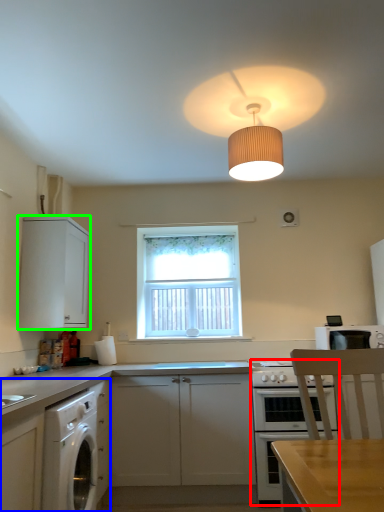
Question: Which object is positioned closest to oven (highlighted by a red box)? Select from cabinetry (highlighted by a blue box) and cabinetry (highlighted by a green box).

Choices:
 (A) cabinetry
 (B) cabinetry

Answer: (A)